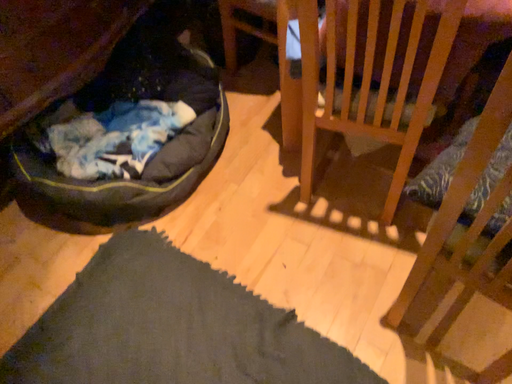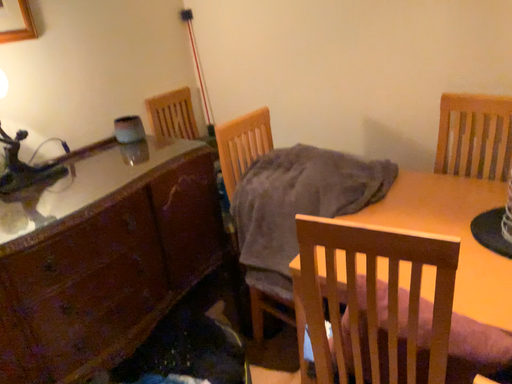
Question: Which way did the camera rotate in the video?

Choices:
 (A) rotated downward
 (B) rotated upward

Answer: (B)